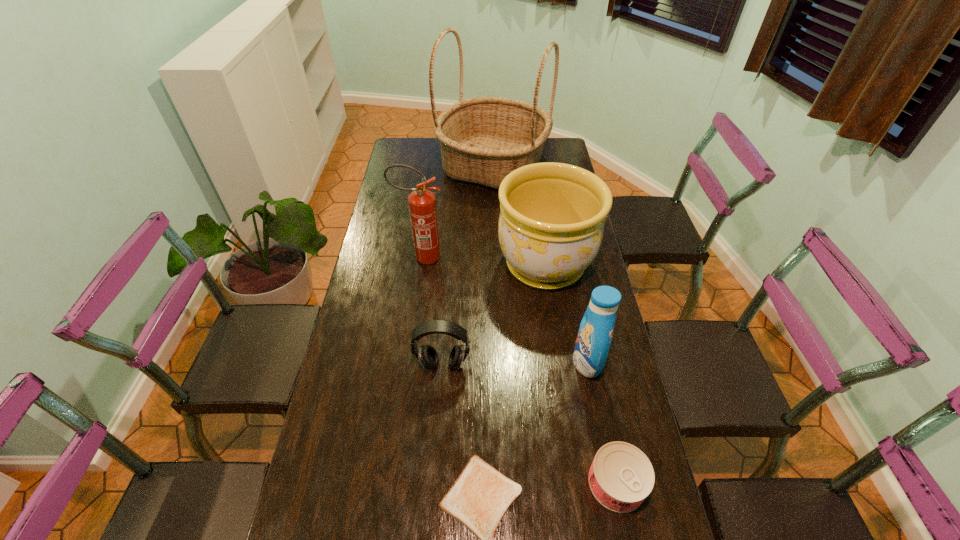
You are a GUI agent. You are given a task and a screenshot of the screen. Output one action in this format:
    pyautogui.click(x=<x>, y=<y>)
    Task: Click on the free spot that satisfies the following two spatial constraints: 1. from the nozzle of the flowerpot; 2. on the left side of the sixth shortest object
    
    Given the screenshot: What is the action you would take?
    pyautogui.click(x=420, y=266)

This screenshot has height=540, width=960. I want to click on free spot that satisfies the following two spatial constraints: 1. on the back side of the second shortest object; 2. from the nozzle of the fire extinguisher, so click(570, 257).

Locate an element on the screen. The image size is (960, 540). free space in the image that satisfies the following two spatial constraints: 1. on the ear cups of the can; 2. on the left side of the third shortest object is located at coordinates (434, 482).